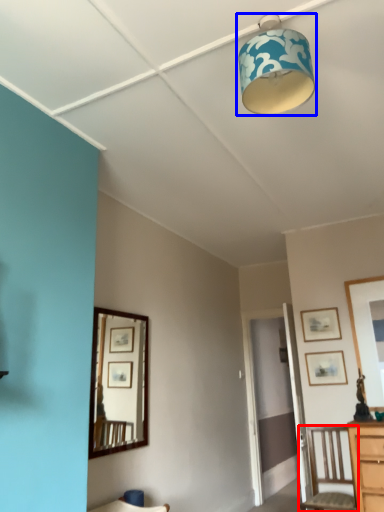
Question: Which object is closer to the camera taking this photo, chair (highlighted by a red box) or lamp (highlighted by a blue box)?

Choices:
 (A) chair
 (B) lamp

Answer: (B)